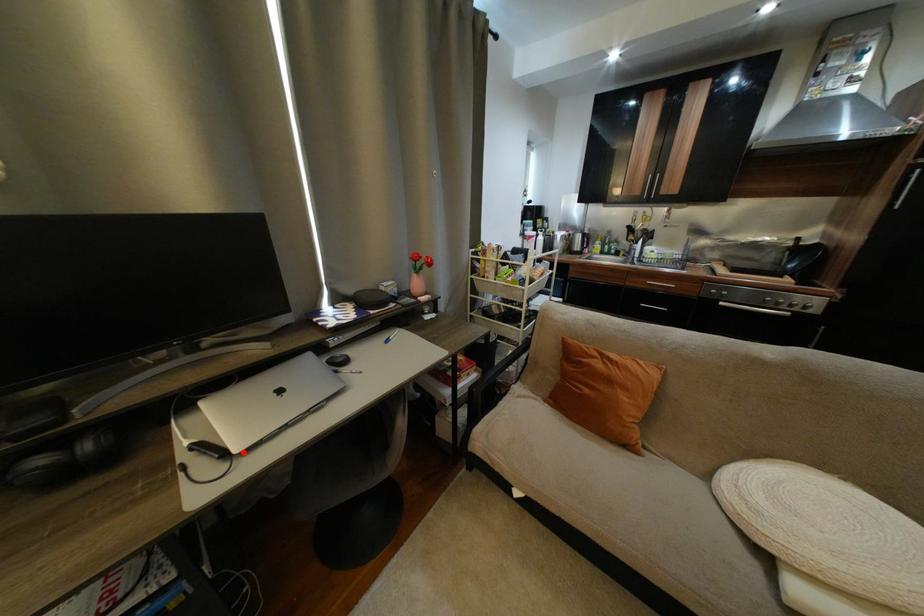
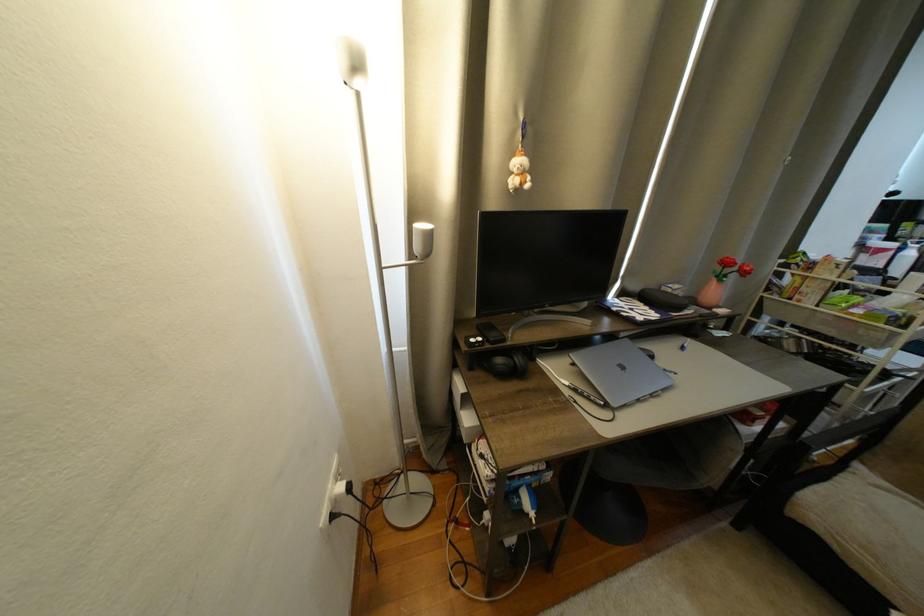
The point at the highlighted location is marked in the first image. Where is the corresponding point in the second image?

(621, 406)